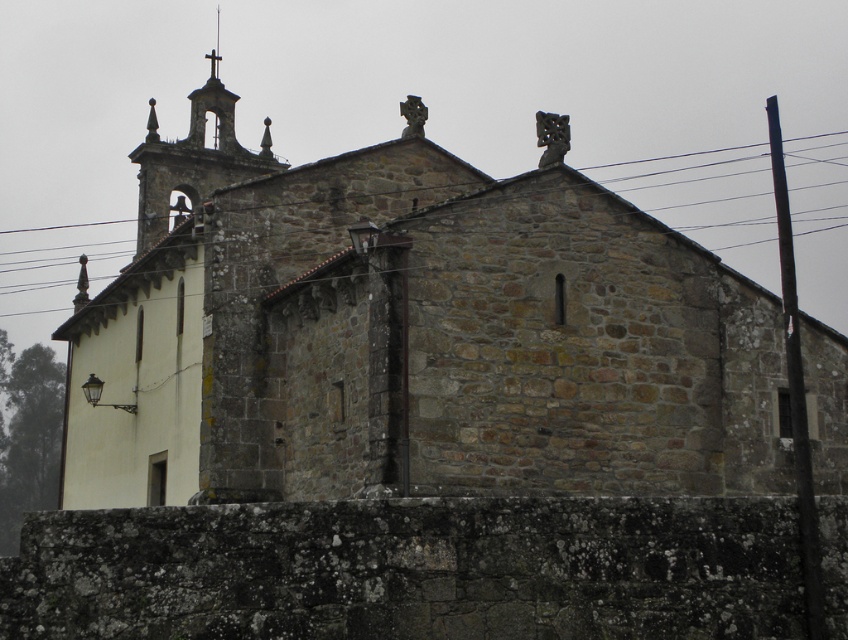
Is stone church at center bigger than black wire at upper center?

Indeed, stone church at center has a larger size compared to black wire at upper center.

Is stone church at center taller than black wire at upper center?

Yes.

Identify the location of stone church at center. The height and width of the screenshot is (640, 848). (425, 336).

Where is `stone church at center`? stone church at center is located at coordinates (425, 336).